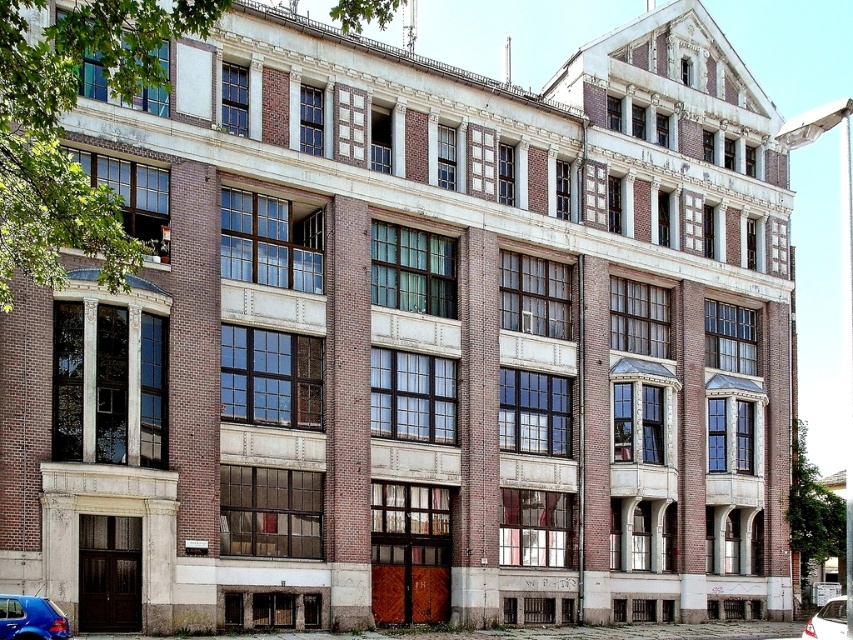
Question: Is shiny blue car at lower left thinner than white glossy car at lower right?

Choices:
 (A) yes
 (B) no

Answer: (A)

Question: Which of the following is the closest to the observer?

Choices:
 (A) (38, 618)
 (B) (840, 637)

Answer: (A)

Question: Observing the image, what is the correct spatial positioning of shiny blue car at lower left in reference to white glossy car at lower right?

Choices:
 (A) left
 (B) right

Answer: (A)

Question: Does shiny blue car at lower left appear on the right side of white glossy car at lower right?

Choices:
 (A) yes
 (B) no

Answer: (B)